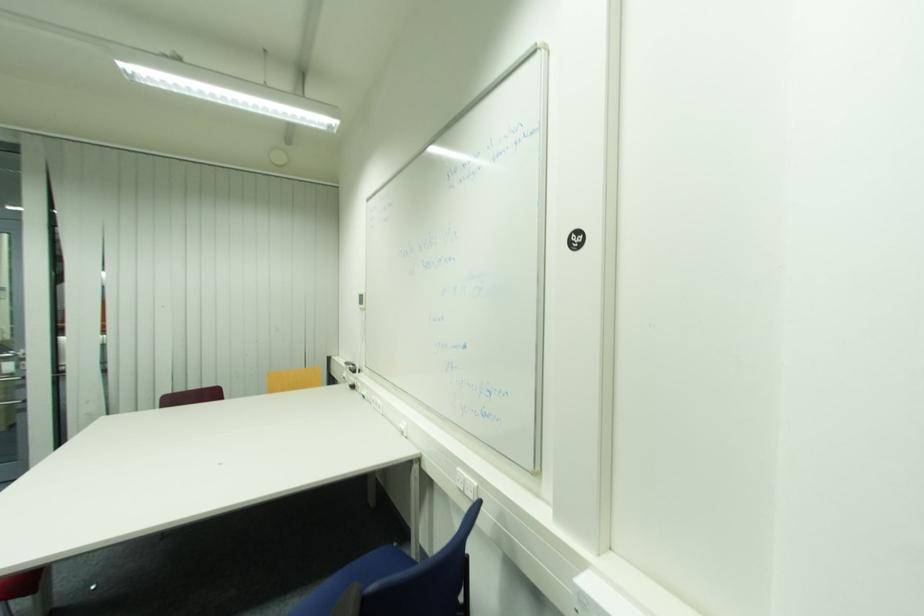
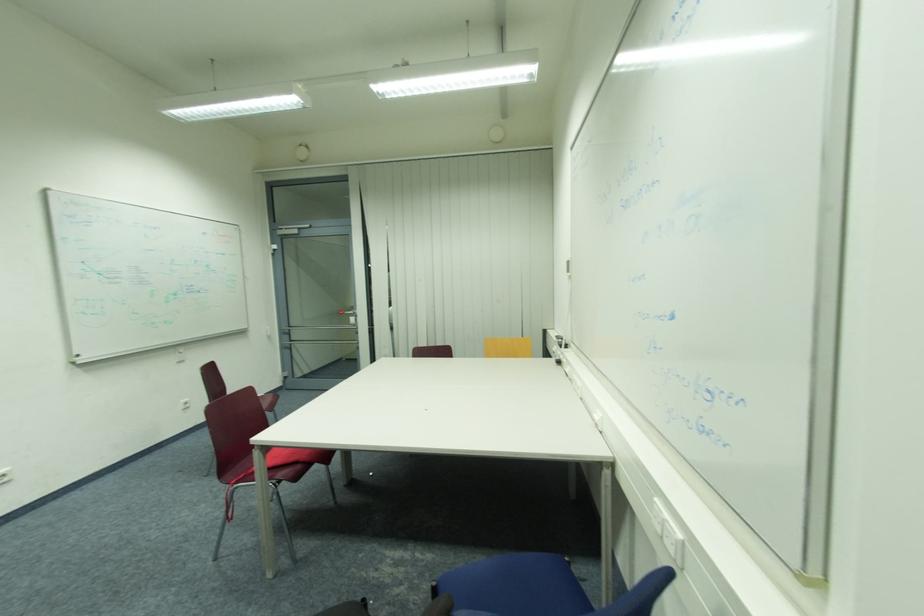
Question: The camera is either moving clockwise (left) or counter-clockwise (right) around the object. The first image is from the beginning of the video and the second image is from the end. Is the camera moving left or right when shooting the video?

Choices:
 (A) Left
 (B) Right

Answer: (B)